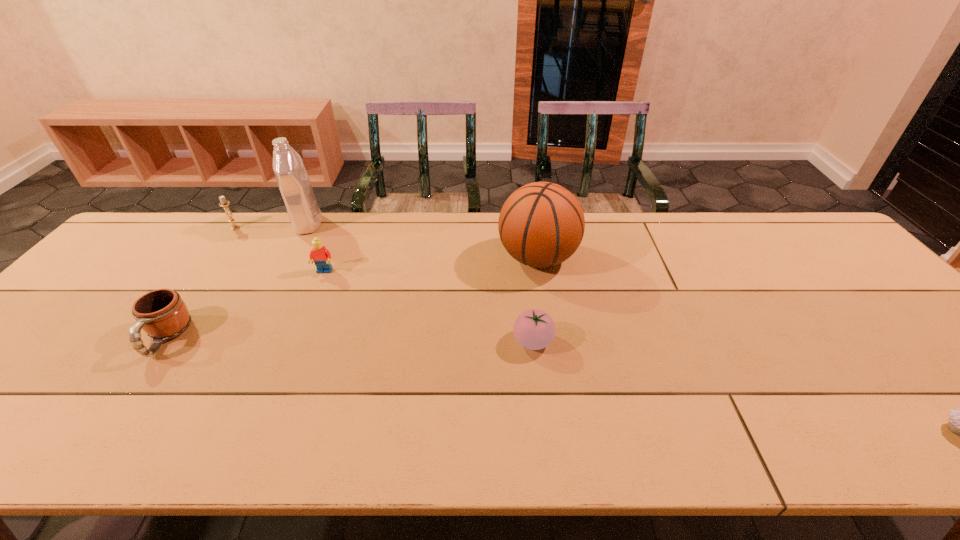
You are a GUI agent. You are given a task and a screenshot of the screen. Output one action in this format:
    pyautogui.click(x=<x>, y=<y>)
    Task: Click on the free space located on the face of the fourth object from right to left
    The height and width of the screenshot is (540, 960).
    Given the screenshot: What is the action you would take?
    pyautogui.click(x=302, y=326)

This screenshot has width=960, height=540. Find the location of `vacant space located on the side of the mug with the handle`. vacant space located on the side of the mug with the handle is located at coordinates (124, 397).

At what (x,y) coordinates should I click in order to perform the action: click on vacant space located 0.200m on the front of the tomato. Please return your answer as a coordinate pair (x, y). Looking at the image, I should click on (544, 437).

At what (x,y) coordinates should I click in order to perform the action: click on detergent that is at the far edge. Please return your answer as a coordinate pair (x, y). This screenshot has width=960, height=540. Looking at the image, I should click on (292, 179).

Locate an element on the screen. This screenshot has height=540, width=960. basketball located at the far edge is located at coordinates (541, 224).

At what (x,y) coordinates should I click in order to perform the action: click on candle holder that is at the far edge. Please return your answer as a coordinate pair (x, y). This screenshot has height=540, width=960. Looking at the image, I should click on (223, 203).

Identify the location of vacant position at the far edge of the desktop. (343, 256).

The image size is (960, 540). Identify the location of vacant area at the near edge of the desktop. (211, 431).

Find the location of a particular element. The height and width of the screenshot is (540, 960). vacant area at the right edge is located at coordinates (832, 283).

Locate an element on the screen. vacant area at the far left corner is located at coordinates (185, 226).